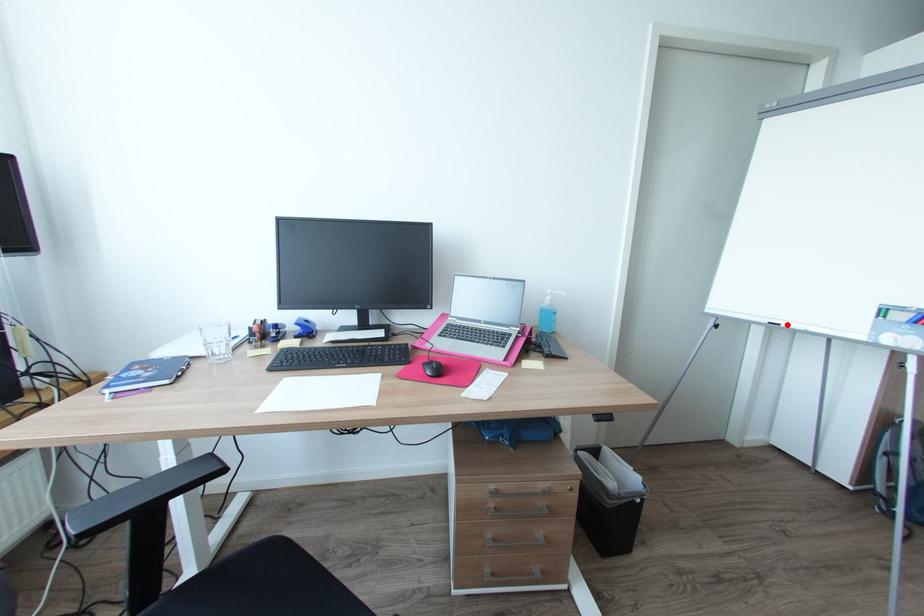
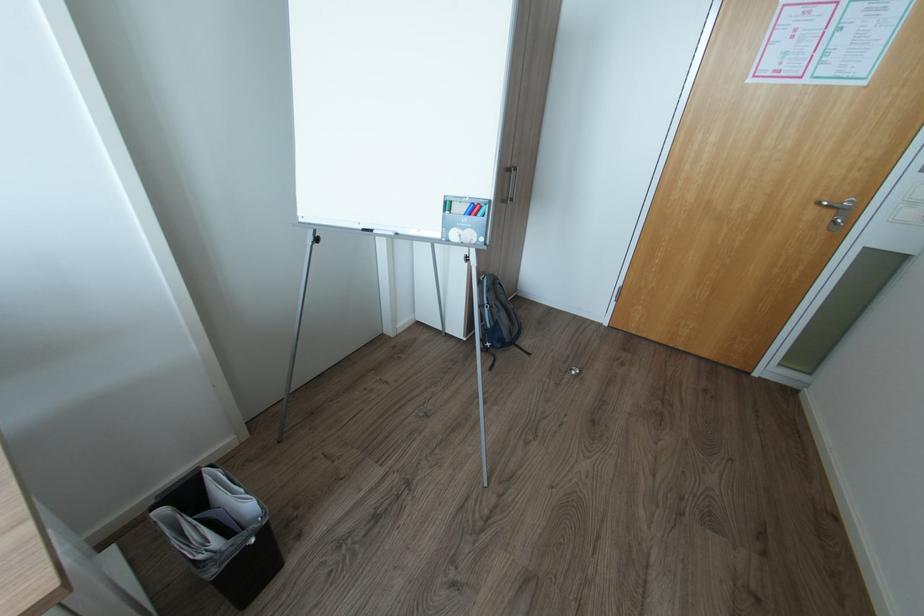
Where in the second image is the point corresponding to the highlighted location from the first image?

(380, 231)